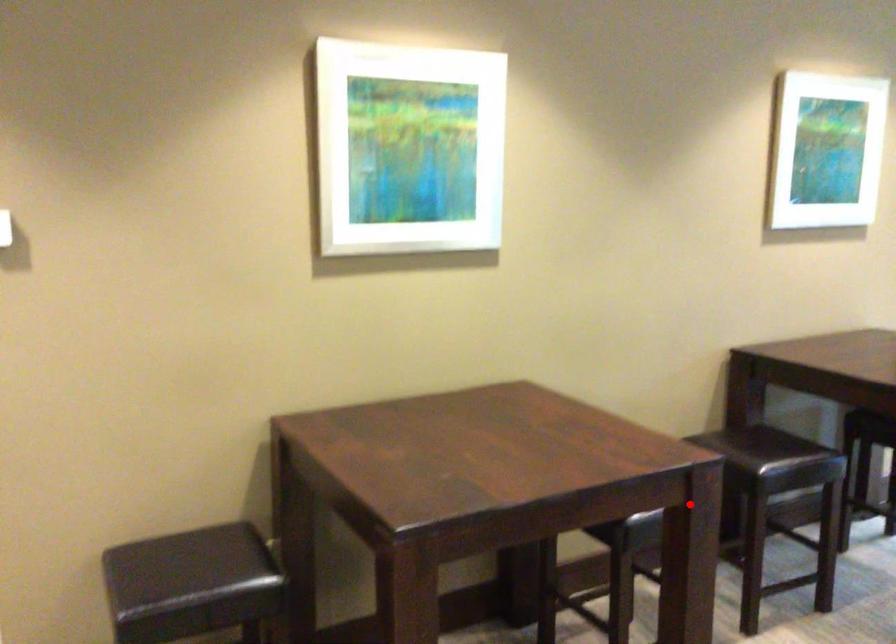
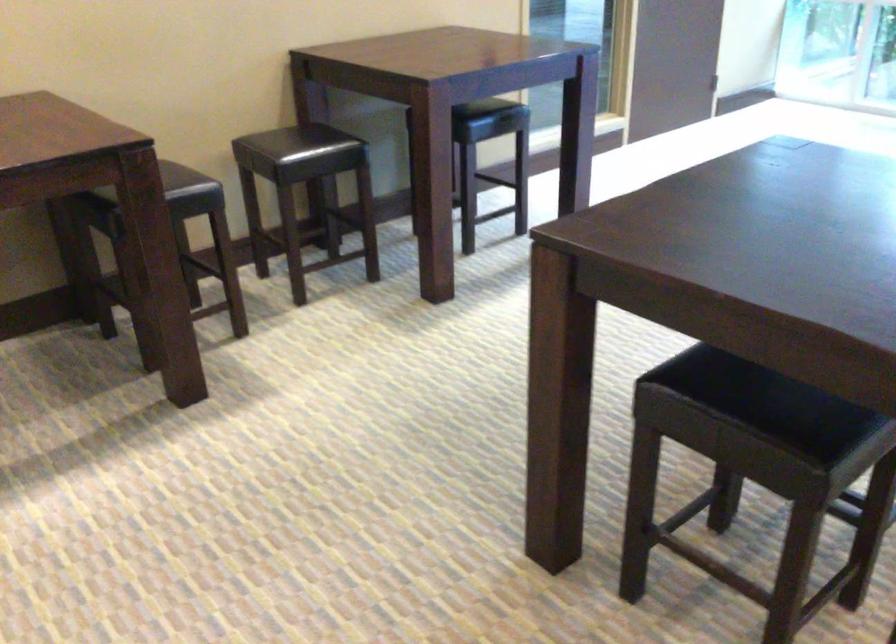
In the second image, find the point that corresponds to the highlighted location in the first image.

(168, 182)